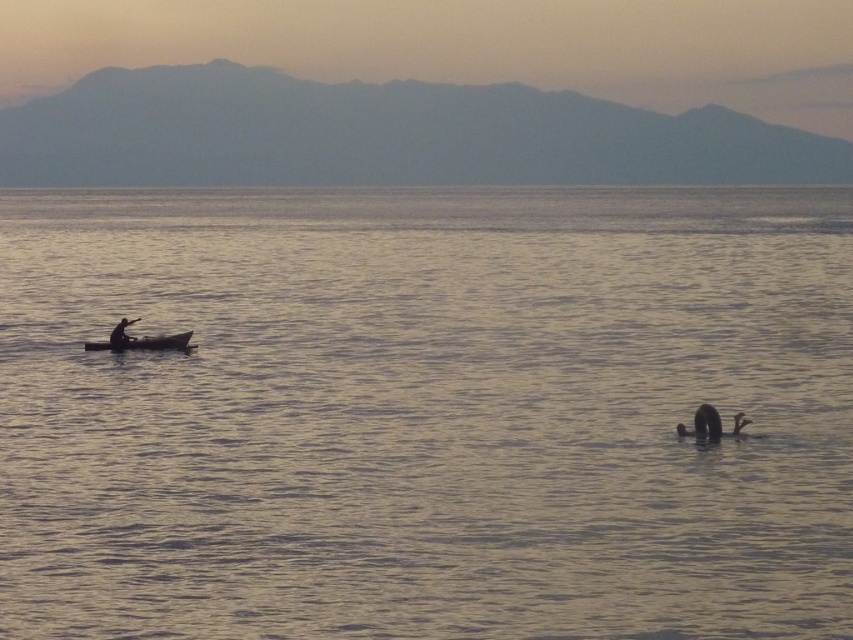
You are standing at point A located at coordinates point A at (158, 337). You want to reach point B located at coordinates point B at 0.628, 0.186. The distance between them is 29.50 meters. You have a remote control boat that can travel at a speed of 1.5 meters per second. How long will it take for the boat to reach point B from point A?

The distance between point A at (158, 337) and point B at 0.628, 0.186 is 29.50 meters. The remote control boat travels at 1.5 meters per second, so the time required is 29.50 divided by 1.5, which equals approximately 19.67 seconds.

You are a photographer planning to take a photo of the smooth water at center and the wooden canoe at left. Based on their positions, which object would appear larger in the photo?

The smooth water at center appears larger in the photo because it is taller than the wooden canoe at left.

You are standing at the camera position and want to walk to the smooth water at center. Is the distance less than 12 meters?

The smooth water at center is 11.68 meters from camera, so yes, the distance is less than 12 meters.